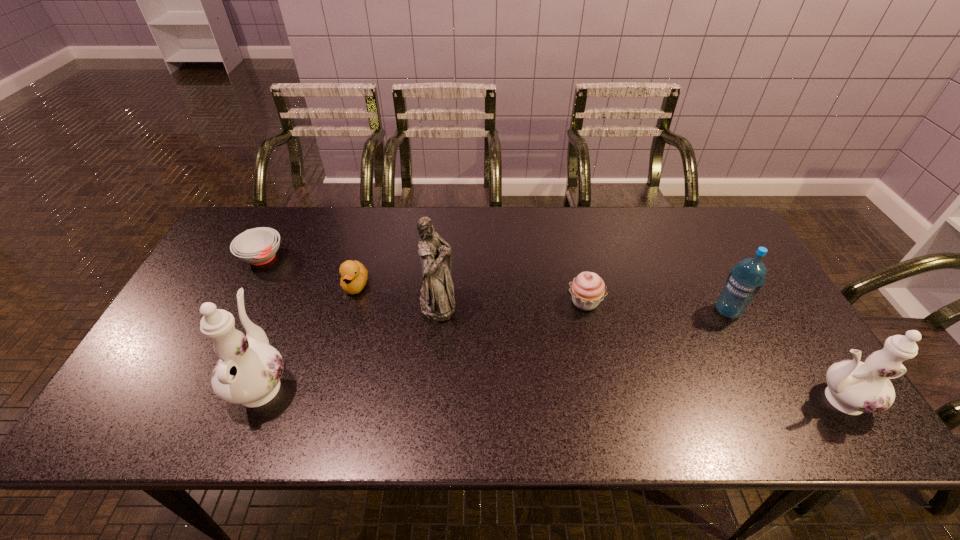
Identify the location of the left chinaware. The image size is (960, 540). (249, 370).

Where is `the taller chinaware`? The height and width of the screenshot is (540, 960). the taller chinaware is located at coordinates (249, 370).

This screenshot has width=960, height=540. In order to click on the right chinaware in this screenshot , I will do `click(854, 387)`.

I want to click on the rightmost object, so click(x=854, y=387).

Locate an element on the screen. duckling is located at coordinates (354, 274).

This screenshot has width=960, height=540. In order to click on water bottle in this screenshot , I will do `click(745, 280)`.

This screenshot has height=540, width=960. In order to click on soup bowl in this screenshot , I will do `click(257, 246)`.

You are a GUI agent. You are given a task and a screenshot of the screen. Output one action in this format:
    pyautogui.click(x=<x>, y=<y>)
    Task: Click on the leftmost object
    The height and width of the screenshot is (540, 960).
    Given the screenshot: What is the action you would take?
    pyautogui.click(x=257, y=246)

At what (x,y) coordinates should I click in order to perform the action: click on cupcake. Please return your answer as a coordinate pair (x, y). The width and height of the screenshot is (960, 540). Looking at the image, I should click on [588, 289].

Find the location of a particular element. figurine is located at coordinates (437, 303).